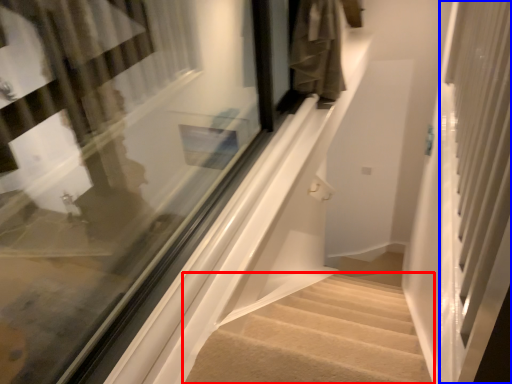
Question: Among these objects, which one is farthest to the camera, stairs (highlighted by a red box) or screen door (highlighted by a blue box)?

Choices:
 (A) stairs
 (B) screen door

Answer: (A)